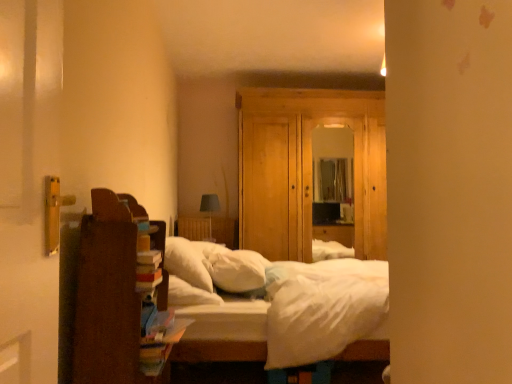
At what (x,y) coordinates should I click in order to perform the action: click on white soft pillow at center, the 1th pillow from the left. Please return your answer as a coordinate pair (x, y). The height and width of the screenshot is (384, 512). Looking at the image, I should click on (190, 261).

Locate an element on the screen. This screenshot has width=512, height=384. wooden dresser at center is located at coordinates (307, 168).

Where is `brown wooden bookshelf at left`? brown wooden bookshelf at left is located at coordinates (109, 295).

Can wooden dresser at center be found inside white soft bed at center?

No, wooden dresser at center is not a part of white soft bed at center.

Considering the sizes of objects white soft bed at center and wooden dresser at center in the image provided, who is shorter, white soft bed at center or wooden dresser at center?

white soft bed at center.

Between white soft bed at center and wooden dresser at center, which one has larger width?

white soft bed at center.

Is white soft pillow at center, the 1th pillow from the left, looking in the opposite direction of white soft bed at center?

Yes, white soft pillow at center, the 1th pillow from the left,'s orientation is away from white soft bed at center.

Which object is closer to the camera, white soft pillow at center, the 1th pillow from the left, or white soft bed at center?

Positioned in front is white soft bed at center.

Is white soft pillow at center, the 2th pillow viewed from the right, bigger than white soft bed at center?

No, white soft pillow at center, the 2th pillow viewed from the right, is not bigger than white soft bed at center.

Who is taller, white soft pillow at center, the 1th pillow from the left, or white soft bed at center?

With more height is white soft bed at center.

Consider the image. Considering the relative sizes of white soft pillow at center, the 2th pillow viewed from the right, and brown wooden bookshelf at left in the image provided, is white soft pillow at center, the 2th pillow viewed from the right, taller than brown wooden bookshelf at left?

No, white soft pillow at center, the 2th pillow viewed from the right, is not taller than brown wooden bookshelf at left.

You are a GUI agent. You are given a task and a screenshot of the screen. Output one action in this format:
    pyautogui.click(x=<x>, y=<y>)
    Task: Click on the cabinetry located below the white soft pillow at center, the 1th pillow from the left (from the image's perspective)
    
    Given the screenshot: What is the action you would take?
    pyautogui.click(x=109, y=295)

Considering the positions of objects white soft pillow at center, the 1th pillow from the left, and brown wooden bookshelf at left in the image provided, who is more to the left, white soft pillow at center, the 1th pillow from the left, or brown wooden bookshelf at left?

brown wooden bookshelf at left.

Is white soft pillow at center, the 2th pillow viewed from the right, thinner than brown wooden bookshelf at left?

Incorrect, the width of white soft pillow at center, the 2th pillow viewed from the right, is not less than that of brown wooden bookshelf at left.

From the image's perspective, which object appears higher, brown wooden bookshelf at left or white soft bed at center?

brown wooden bookshelf at left appears higher in the image.

Consider the image. How many degrees apart are the facing directions of brown wooden bookshelf at left and white soft bed at center?

They differ by 0.718 degrees in their facing directions.

Which object is closer to the camera taking this photo, brown wooden bookshelf at left or white soft bed at center?

brown wooden bookshelf at left.

Considering the positions of objects brown wooden bookshelf at left and white soft bed at center in the image provided, who is more to the right, brown wooden bookshelf at left or white soft bed at center?

white soft bed at center.

Considering the relative sizes of white soft bed at center and white soft pillow at center, the 2th pillow viewed from the right, in the image provided, is white soft bed at center thinner than white soft pillow at center, the 2th pillow viewed from the right,?

In fact, white soft bed at center might be wider than white soft pillow at center, the 2th pillow viewed from the right.

How far apart are white soft bed at center and white soft pillow at center, the 1th pillow from the left?

They are 3.68 inches apart.

Does white soft bed at center appear on the right side of white soft pillow at center, the 1th pillow from the left?

Correct, you'll find white soft bed at center to the right of white soft pillow at center, the 1th pillow from the left.

Consider the image. From the image's perspective, which object appears higher, white soft bed at center or white soft pillow at center, the 2th pillow viewed from the right?

white soft pillow at center, the 2th pillow viewed from the right.

From the image's perspective, is white soft pillow at center, which is the first pillow from right to left, located above wooden dresser at center?

Actually, white soft pillow at center, which is the first pillow from right to left, appears below wooden dresser at center in the image.

Choose the correct answer: Is white soft pillow at center, which is the 2th pillow from left to right, inside wooden dresser at center or outside it?

white soft pillow at center, which is the 2th pillow from left to right, cannot be found inside wooden dresser at center.

Considering the positions of objects white soft pillow at center, which is the 2th pillow from left to right, and wooden dresser at center in the image provided, who is in front, white soft pillow at center, which is the 2th pillow from left to right, or wooden dresser at center?

white soft pillow at center, which is the 2th pillow from left to right.

Which is correct: brown wooden bookshelf at left is inside white soft pillow at center, which is the 2th pillow from left to right, or outside of it?

brown wooden bookshelf at left is located beyond the bounds of white soft pillow at center, which is the 2th pillow from left to right.

Considering the sizes of objects brown wooden bookshelf at left and white soft pillow at center, which is the 2th pillow from left to right, in the image provided, who is taller, brown wooden bookshelf at left or white soft pillow at center, which is the 2th pillow from left to right,?

With more height is brown wooden bookshelf at left.

Which of these two, brown wooden bookshelf at left or white soft pillow at center, which is the 2th pillow from left to right, is wider?

With larger width is white soft pillow at center, which is the 2th pillow from left to right.

Is brown wooden bookshelf at left aimed at white soft pillow at center, which is the 2th pillow from left to right?

No.

I want to click on bed on the left of wooden dresser at center, so 212,310.

Locate an element on the screen. the 1st pillow behind the white soft bed at center is located at coordinates (190, 261).

Estimate the real-world distances between objects in this image. Which object is further from white soft pillow at center, the 2th pillow viewed from the right, brown wooden bookshelf at left or white soft bed at center?

Among the two, brown wooden bookshelf at left is located further to white soft pillow at center, the 2th pillow viewed from the right.

Estimate the real-world distances between objects in this image. Which object is closer to wooden dresser at center, white soft pillow at center, the 1th pillow from the left, or white soft pillow at center, which is the first pillow from right to left?

white soft pillow at center, which is the first pillow from right to left, is positioned closer to the anchor wooden dresser at center.

Considering their positions, is white soft pillow at center, the 2th pillow viewed from the right, positioned closer to white soft pillow at center, which is the first pillow from right to left, than white soft bed at center?

white soft pillow at center, the 2th pillow viewed from the right, is positioned closer to the anchor white soft pillow at center, which is the first pillow from right to left.

Estimate the real-world distances between objects in this image. Which object is further from white soft bed at center, white soft pillow at center, which is the first pillow from right to left, or brown wooden bookshelf at left?

Among the two, brown wooden bookshelf at left is located further to white soft bed at center.

When comparing their distances from white soft pillow at center, the 1th pillow from the left, does brown wooden bookshelf at left or white soft pillow at center, which is the 2th pillow from left to right, seem closer?

The object closer to white soft pillow at center, the 1th pillow from the left, is white soft pillow at center, which is the 2th pillow from left to right.

Which object lies nearer to the anchor point brown wooden bookshelf at left, white soft pillow at center, the 1th pillow from the left, or wooden dresser at center?

Among the two, white soft pillow at center, the 1th pillow from the left, is located nearer to brown wooden bookshelf at left.

From the image, which object appears to be farther from brown wooden bookshelf at left, white soft bed at center or white soft pillow at center, which is the first pillow from right to left?

white soft pillow at center, which is the first pillow from right to left, is positioned further to the anchor brown wooden bookshelf at left.

Which object lies nearer to the anchor point white soft pillow at center, the 2th pillow viewed from the right, white soft bed at center or wooden dresser at center?

white soft bed at center is closer to white soft pillow at center, the 2th pillow viewed from the right.

The height and width of the screenshot is (384, 512). I want to click on pillow situated between white soft pillow at center, the 2th pillow viewed from the right, and white soft bed at center from left to right, so click(237, 270).

Where is `bed between brown wooden bookshelf at left and white soft pillow at center, the 2th pillow viewed from the right, in the front-back direction`? This screenshot has width=512, height=384. bed between brown wooden bookshelf at left and white soft pillow at center, the 2th pillow viewed from the right, in the front-back direction is located at coordinates (212, 310).

Identify the location of bed located between brown wooden bookshelf at left and wooden dresser at center in the depth direction. This screenshot has width=512, height=384. (212, 310).

Locate an element on the screen. This screenshot has height=384, width=512. bed between brown wooden bookshelf at left and white soft pillow at center, which is the first pillow from right to left, from front to back is located at coordinates (212, 310).